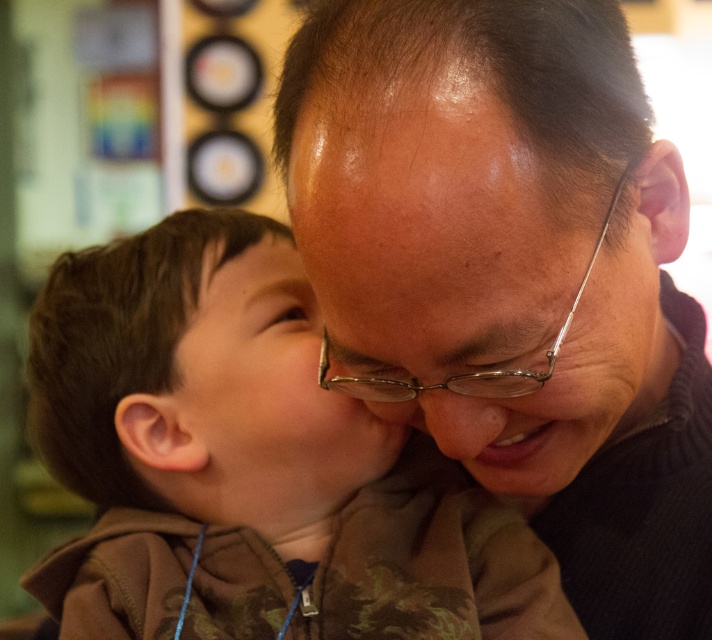
Question: Can you confirm if brown camouflage hoodie at center is thinner than matte skin nose at center?

Choices:
 (A) no
 (B) yes

Answer: (A)

Question: Estimate the real-world distances between objects in this image. Which object is closer to the matte brown sweater at center?

Choices:
 (A) brown camouflage hoodie at center
 (B) clear plastic glasses at center
 (C) matte brown face at center

Answer: (B)

Question: Which point is closer to the camera?

Choices:
 (A) (582, 276)
 (B) (476, 138)

Answer: (B)

Question: Can you confirm if matte brown face at center is thinner than clear plastic glasses at center?

Choices:
 (A) yes
 (B) no

Answer: (B)

Question: Is matte brown sweater at center above brown camouflage hoodie at center?

Choices:
 (A) yes
 (B) no

Answer: (A)

Question: Which object is positioned farthest from the clear plastic glasses at center?

Choices:
 (A) brown camouflage hoodie at center
 (B) matte brown face at center

Answer: (A)